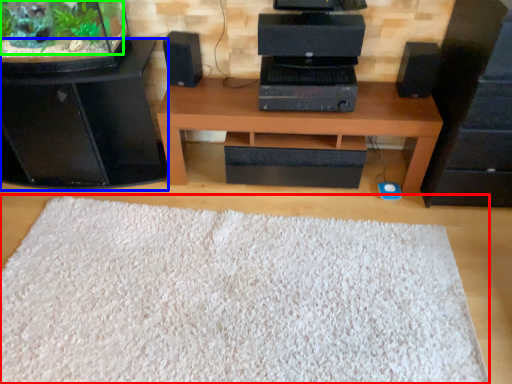
Question: Based on their relative distances, which object is farther from mat (highlighted by a red box)? Choose from furniture (highlighted by a blue box) and plant (highlighted by a green box).

Choices:
 (A) furniture
 (B) plant

Answer: (B)